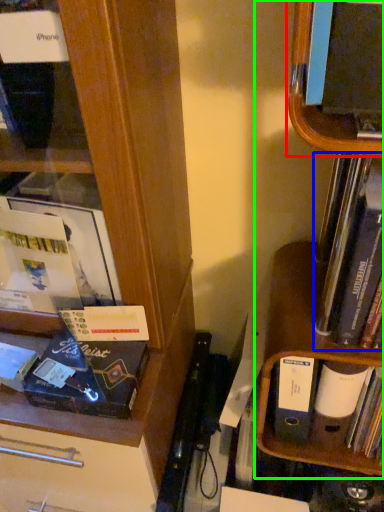
Question: Which is farther away from shelf (highlighted by a red box)? book (highlighted by a blue box) or shelf (highlighted by a green box)?

Choices:
 (A) book
 (B) shelf

Answer: (B)